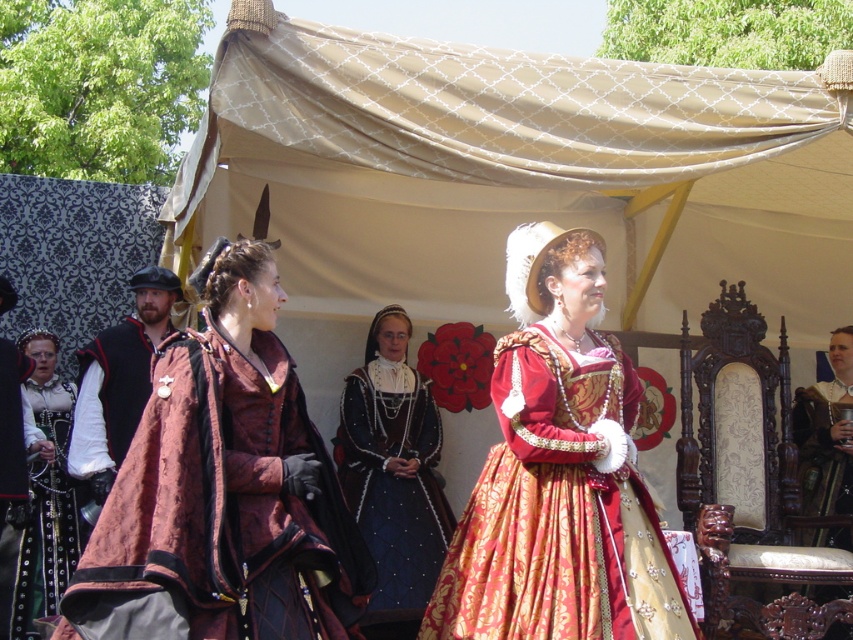
How much distance is there between dark blue satin gown at center and black leather belt at left?

dark blue satin gown at center is 10.72 meters from black leather belt at left.

Who is positioned more to the left, dark blue satin gown at center or black leather belt at left?

black leather belt at left

Is point (405, 586) in front of point (3, 387)?

That is True.

I want to click on dark blue satin gown at center, so click(393, 474).

Who is higher up, gold brocade dress at center or velvet black vest at left?

Positioned higher is velvet black vest at left.

Does gold brocade dress at center have a lesser height compared to velvet black vest at left?

No.

What do you see at coordinates (558, 474) in the screenshot? This screenshot has height=640, width=853. I see `gold brocade dress at center` at bounding box center [558, 474].

The height and width of the screenshot is (640, 853). I want to click on gold brocade dress at center, so click(558, 474).

Based on the photo, is gold brocade dress at center below black leather belt at left?

Incorrect, gold brocade dress at center is not positioned below black leather belt at left.

Between point (531, 480) and point (1, 516), which one is positioned behind?

The point (1, 516) is behind.

Is point (496, 499) behind point (13, 460)?

No, it is in front of (13, 460).

Locate an element on the screen. gold brocade dress at center is located at coordinates (558, 474).